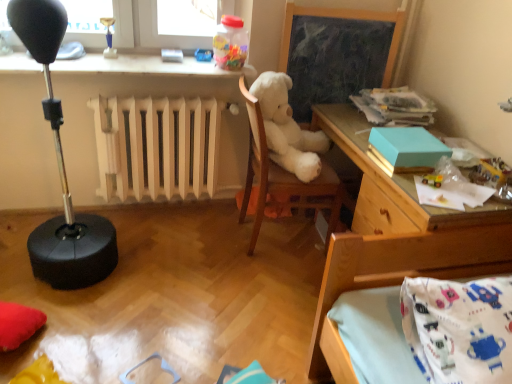
You are a GUI agent. You are given a task and a screenshot of the screen. Output one action in this format:
    pyautogui.click(x=<x>, y=<y>)
    Task: Click on the vacant space situated on the left part of translucent plastic container at upper center, which is the second toy in left-to-right order
    
    Given the screenshot: What is the action you would take?
    pyautogui.click(x=189, y=63)